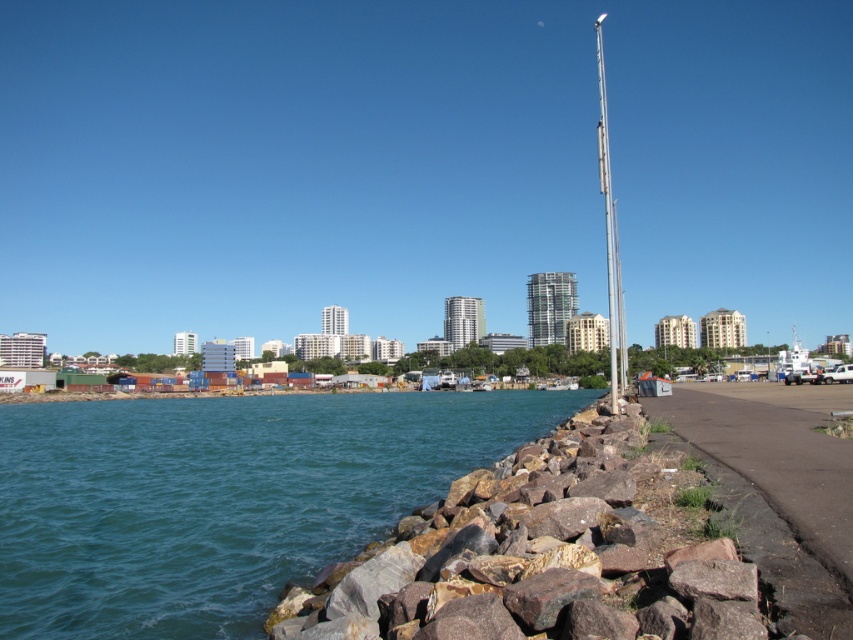
Question: Which object is the closest to the rocky at lower right?

Choices:
 (A) teal rock at lower left
 (B) silver metallic flag pole at right

Answer: (A)

Question: Is the position of teal rock at lower left less distant than that of silver metallic flag pole at right?

Choices:
 (A) no
 (B) yes

Answer: (B)

Question: From the image, what is the correct spatial relationship of teal rock at lower left in relation to silver metallic flag pole at right?

Choices:
 (A) below
 (B) above

Answer: (A)

Question: Which object is farther from the camera taking this photo?

Choices:
 (A) rocky at lower right
 (B) silver metallic flag pole at right
 (C) teal rock at lower left

Answer: (B)

Question: Which is farther from the silver metallic flag pole at right?

Choices:
 (A) teal rock at lower left
 (B) rocky at lower right

Answer: (A)

Question: Can you confirm if teal rock at lower left is bigger than silver metallic flag pole at right?

Choices:
 (A) yes
 (B) no

Answer: (B)